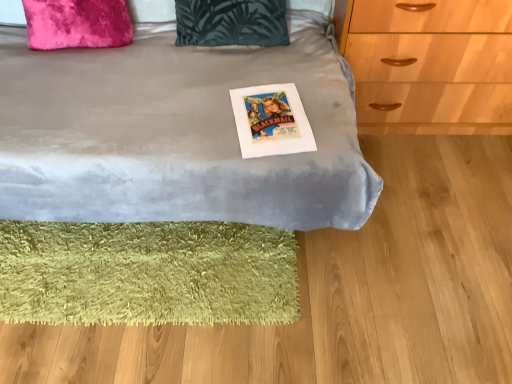
Measure the distance between green shaggy rug at lower left and camera.

green shaggy rug at lower left and camera are 1.32 meters apart.

Locate an element on the screen. dark green fabric pillow at upper center, placed as the second pillow when sorted from left to right is located at coordinates (231, 22).

What do you see at coordinates (231, 22) in the screenshot?
I see `dark green fabric pillow at upper center, placed as the second pillow when sorted from left to right` at bounding box center [231, 22].

Where is `velvet pink pillow at upper left, the 1th pillow viewed from the left`? velvet pink pillow at upper left, the 1th pillow viewed from the left is located at coordinates (77, 24).

From the image's perspective, is velvet pink pillow at upper left, arranged as the 2th pillow when viewed from the right, above velvet gray bed at center?

Yes, from the image's perspective, velvet pink pillow at upper left, arranged as the 2th pillow when viewed from the right, is on top of velvet gray bed at center.

How different are the orientations of velvet pink pillow at upper left, arranged as the 2th pillow when viewed from the right, and velvet gray bed at center in degrees?

velvet pink pillow at upper left, arranged as the 2th pillow when viewed from the right, and velvet gray bed at center are facing 2.72 degrees away from each other.

Is velvet gray bed at center a part of velvet pink pillow at upper left, the 1th pillow viewed from the left?

No, velvet gray bed at center is not a part of velvet pink pillow at upper left, the 1th pillow viewed from the left.

Does velvet pink pillow at upper left, arranged as the 2th pillow when viewed from the right, have a greater width compared to velvet gray bed at center?

No.

This screenshot has width=512, height=384. In order to click on pillow that is the 1st one when counting leftward from the white paper poster at center in this screenshot , I will do `click(231, 22)`.

Is dark green fabric pillow at upper center, placed as the second pillow when sorted from left to right, to the left of white paper poster at center from the viewer's perspective?

Yes.

Can you tell me how much dark green fabric pillow at upper center, placed as the second pillow when sorted from left to right, and white paper poster at center differ in facing direction?

The facing directions of dark green fabric pillow at upper center, placed as the second pillow when sorted from left to right, and white paper poster at center are 9.77 degrees apart.

Are dark green fabric pillow at upper center, which is the 1th pillow in right-to-left order, and white paper poster at center making contact?

No, dark green fabric pillow at upper center, which is the 1th pillow in right-to-left order, is not making contact with white paper poster at center.

Is there a large distance between dark green fabric pillow at upper center, which is the 1th pillow in right-to-left order, and green shaggy rug at lower left?

No, there isn't a large distance between dark green fabric pillow at upper center, which is the 1th pillow in right-to-left order, and green shaggy rug at lower left.

Can you confirm if dark green fabric pillow at upper center, placed as the second pillow when sorted from left to right, is taller than green shaggy rug at lower left?

Yes.

From the image's perspective, is dark green fabric pillow at upper center, which is the 1th pillow in right-to-left order, positioned above or below green shaggy rug at lower left?

dark green fabric pillow at upper center, which is the 1th pillow in right-to-left order, is above green shaggy rug at lower left.

From a real-world perspective, which pillow is the 2nd one above the green shaggy rug at lower left? Please provide its 2D coordinates.

[(231, 22)]

From the picture: Relative to velvet gray bed at center, is dark green fabric pillow at upper center, which is the 1th pillow in right-to-left order, in front or behind?

In the image, dark green fabric pillow at upper center, which is the 1th pillow in right-to-left order, appears behind velvet gray bed at center.

Does point (210, 29) come farther from viewer compared to point (252, 78)?

Yes, point (210, 29) is farther from viewer.

Can you confirm if dark green fabric pillow at upper center, placed as the second pillow when sorted from left to right, is thinner than velvet gray bed at center?

Yes.

Is dark green fabric pillow at upper center, which is the 1th pillow in right-to-left order, aimed at velvet gray bed at center?

Yes, dark green fabric pillow at upper center, which is the 1th pillow in right-to-left order, is turned towards velvet gray bed at center.

From a real-world perspective, is velvet pink pillow at upper left, the 1th pillow viewed from the left, positioned under green shaggy rug at lower left based on gravity?

No, from a real-world perspective, velvet pink pillow at upper left, the 1th pillow viewed from the left, is not beneath green shaggy rug at lower left.

Is velvet pink pillow at upper left, arranged as the 2th pillow when viewed from the right, aimed at green shaggy rug at lower left?

No.

Is velvet pink pillow at upper left, the 1th pillow viewed from the left, beside green shaggy rug at lower left?

No, velvet pink pillow at upper left, the 1th pillow viewed from the left, is not with green shaggy rug at lower left.

How different are the orientations of velvet pink pillow at upper left, the 1th pillow viewed from the left, and green shaggy rug at lower left in degrees?

2.45 degrees.

From a real-world perspective, is green shaggy rug at lower left under dark green fabric pillow at upper center, placed as the second pillow when sorted from left to right?

Yes, from a real-world perspective, green shaggy rug at lower left is beneath dark green fabric pillow at upper center, placed as the second pillow when sorted from left to right.

Who is smaller, green shaggy rug at lower left or dark green fabric pillow at upper center, which is the 1th pillow in right-to-left order?

With smaller size is dark green fabric pillow at upper center, which is the 1th pillow in right-to-left order.

Between green shaggy rug at lower left and dark green fabric pillow at upper center, which is the 1th pillow in right-to-left order, which one is positioned in front?

green shaggy rug at lower left is closer to the camera.

Is point (90, 259) closer or farther from the camera than point (282, 42)?

Point (90, 259).

From a real-world perspective, is velvet pink pillow at upper left, arranged as the 2th pillow when viewed from the right, located beneath dark green fabric pillow at upper center, which is the 1th pillow in right-to-left order?

Indeed, from a real-world perspective, velvet pink pillow at upper left, arranged as the 2th pillow when viewed from the right, is positioned beneath dark green fabric pillow at upper center, which is the 1th pillow in right-to-left order.

Is point (104, 18) positioned after point (225, 38)?

No, (104, 18) is closer to viewer.

Where is `pillow that appears below the dark green fabric pillow at upper center, placed as the second pillow when sorted from left to right (from a real-world perspective)`? The width and height of the screenshot is (512, 384). pillow that appears below the dark green fabric pillow at upper center, placed as the second pillow when sorted from left to right (from a real-world perspective) is located at coordinates (77, 24).

Image resolution: width=512 pixels, height=384 pixels. I want to click on bed below the velvet pink pillow at upper left, arranged as the 2th pillow when viewed from the right (from the image's perspective), so click(176, 133).

Locate an element on the screen. This screenshot has height=384, width=512. postcard directly beneath the dark green fabric pillow at upper center, placed as the second pillow when sorted from left to right (from a real-world perspective) is located at coordinates (271, 121).

Which object lies nearer to the anchor point white paper poster at center, velvet pink pillow at upper left, the 1th pillow viewed from the left, or dark green fabric pillow at upper center, placed as the second pillow when sorted from left to right?

dark green fabric pillow at upper center, placed as the second pillow when sorted from left to right.

When comparing their distances from dark green fabric pillow at upper center, which is the 1th pillow in right-to-left order, does velvet gray bed at center or velvet pink pillow at upper left, the 1th pillow viewed from the left, seem closer?

The object closer to dark green fabric pillow at upper center, which is the 1th pillow in right-to-left order, is velvet gray bed at center.

Which object lies nearer to the anchor point velvet gray bed at center, white paper poster at center or dark green fabric pillow at upper center, placed as the second pillow when sorted from left to right?

Based on the image, white paper poster at center appears to be nearer to velvet gray bed at center.

Which object lies nearer to the anchor point white paper poster at center, dark green fabric pillow at upper center, placed as the second pillow when sorted from left to right, or green shaggy rug at lower left?

dark green fabric pillow at upper center, placed as the second pillow when sorted from left to right.

Considering their positions, is dark green fabric pillow at upper center, which is the 1th pillow in right-to-left order, positioned closer to velvet gray bed at center than green shaggy rug at lower left?

dark green fabric pillow at upper center, which is the 1th pillow in right-to-left order, is closer to velvet gray bed at center.

Estimate the real-world distances between objects in this image. Which object is further from velvet pink pillow at upper left, the 1th pillow viewed from the left, velvet gray bed at center or dark green fabric pillow at upper center, which is the 1th pillow in right-to-left order?

velvet gray bed at center is further to velvet pink pillow at upper left, the 1th pillow viewed from the left.

Looking at the image, which one is located further to velvet gray bed at center, white paper poster at center or green shaggy rug at lower left?

green shaggy rug at lower left.

Based on their spatial positions, is green shaggy rug at lower left or white paper poster at center further from velvet gray bed at center?

Among the two, green shaggy rug at lower left is located further to velvet gray bed at center.

I want to click on bed between dark green fabric pillow at upper center, which is the 1th pillow in right-to-left order, and green shaggy rug at lower left in the up-down direction, so click(176, 133).

This screenshot has width=512, height=384. In order to click on postcard between velvet pink pillow at upper left, the 1th pillow viewed from the left, and green shaggy rug at lower left vertically in this screenshot , I will do `click(271, 121)`.

Where is `postcard positioned between velvet gray bed at center and dark green fabric pillow at upper center, placed as the second pillow when sorted from left to right, from near to far`? This screenshot has height=384, width=512. postcard positioned between velvet gray bed at center and dark green fabric pillow at upper center, placed as the second pillow when sorted from left to right, from near to far is located at coordinates (271, 121).

Locate an element on the screen. bed between velvet pink pillow at upper left, the 1th pillow viewed from the left, and green shaggy rug at lower left from top to bottom is located at coordinates (176, 133).